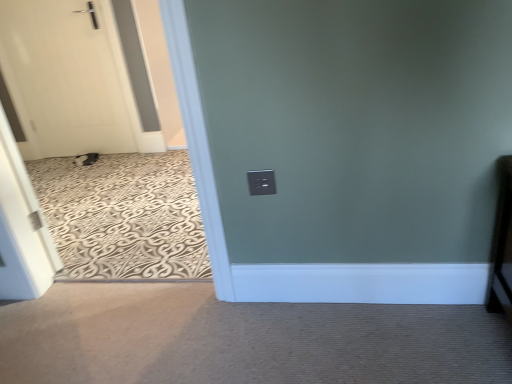
Question: Is white matte door at left surrounding black plastic electric outlet at center?

Choices:
 (A) yes
 (B) no

Answer: (B)

Question: Is white matte door at left not within black plastic electric outlet at center?

Choices:
 (A) yes
 (B) no

Answer: (A)

Question: Considering the relative positions of white matte door at left and black plastic electric outlet at center in the image provided, is white matte door at left in front of black plastic electric outlet at center?

Choices:
 (A) yes
 (B) no

Answer: (B)

Question: Is white matte door at left not close to black plastic electric outlet at center?

Choices:
 (A) no
 (B) yes

Answer: (B)

Question: Is the position of white matte door at left more distant than that of black plastic electric outlet at center?

Choices:
 (A) no
 (B) yes

Answer: (B)

Question: Is white matte door at left facing towards black plastic electric outlet at center?

Choices:
 (A) no
 (B) yes

Answer: (A)

Question: Is black plastic electric outlet at center beside white matte door at left?

Choices:
 (A) yes
 (B) no

Answer: (B)

Question: Is black plastic electric outlet at center at the right side of white matte door at left?

Choices:
 (A) no
 (B) yes

Answer: (B)

Question: From a real-world perspective, is black plastic electric outlet at center positioned over white matte door at left based on gravity?

Choices:
 (A) yes
 (B) no

Answer: (B)

Question: Is black plastic electric outlet at center facing towards white matte door at left?

Choices:
 (A) yes
 (B) no

Answer: (B)

Question: Is black plastic electric outlet at center bigger than white matte door at left?

Choices:
 (A) yes
 (B) no

Answer: (B)

Question: Does black plastic electric outlet at center have a greater height compared to white matte door at left?

Choices:
 (A) no
 (B) yes

Answer: (A)

Question: Would you say white matte door at left is to the left or to the right of black plastic electric outlet at center in the picture?

Choices:
 (A) right
 (B) left

Answer: (B)